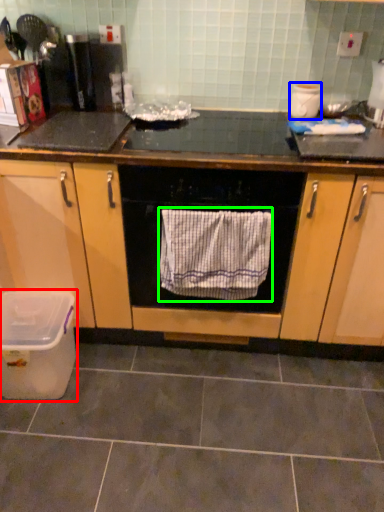
Question: Which object is the farthest from kitchen appliance (highlighted by a red box)? Choose among these: appliance (highlighted by a blue box) or bath towel (highlighted by a green box).

Choices:
 (A) appliance
 (B) bath towel

Answer: (A)